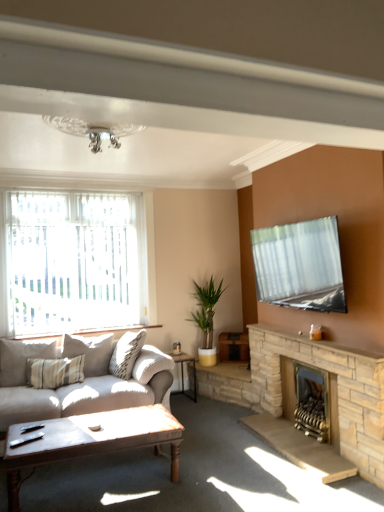
Question: Is point coord(36,356) closer or farther from the camera than point coord(289,404)?

Choices:
 (A) farther
 (B) closer

Answer: (A)

Question: Looking at their shapes, would you say light beige fabric pillow at left is wider or thinner than brick fireplace at lower right, which is counted as the 2th fireplace, starting from the front?

Choices:
 (A) wide
 (B) thin

Answer: (A)

Question: Which object is positioned closest to the translucent fabric window at left?

Choices:
 (A) wooden polished coffee table at lower center
 (B) brick fireplace at lower right, which is counted as the 2th fireplace, starting from the front
 (C) wooden side table at center
 (D) light beige fabric pillow at left
 (E) stone fireplace at right

Answer: (D)

Question: Which object is positioned closest to the green leafy plant at center?

Choices:
 (A) light beige fabric pillow at left
 (B) stone fireplace at right
 (C) stone fireplace at right, which is the 1th fireplace in front-to-back order
 (D) wooden side table at center
 (E) wooden polished coffee table at lower center

Answer: (D)